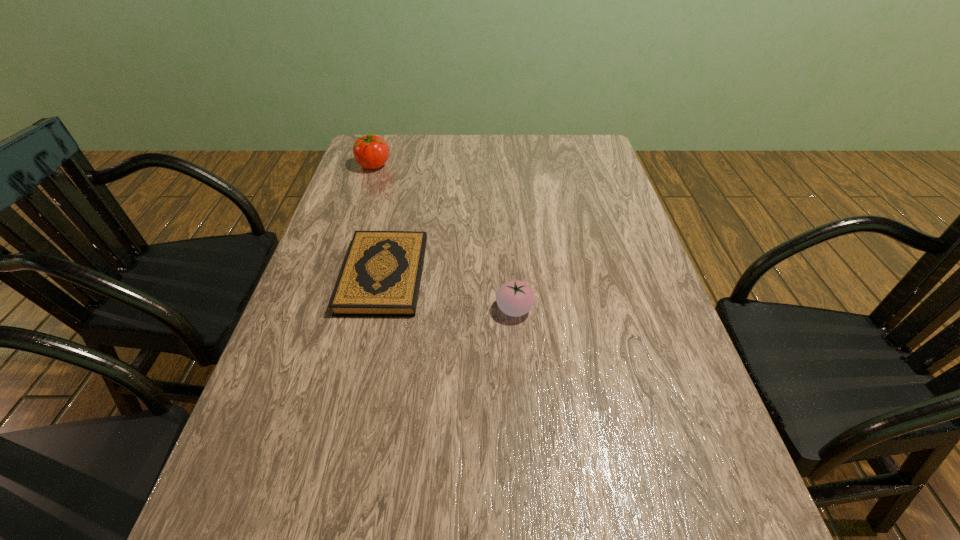
Locate an element on the screen. the left tomato is located at coordinates (371, 151).

Locate an element on the screen. the farthest object is located at coordinates (371, 151).

At what (x,y) coordinates should I click in order to perform the action: click on the second tallest object. Please return your answer as a coordinate pair (x, y). Looking at the image, I should click on (515, 298).

Identify the location of the rightmost object. (515, 298).

At what (x,y) coordinates should I click in order to perform the action: click on hardback book. Please return your answer as a coordinate pair (x, y). Looking at the image, I should click on (381, 275).

The width and height of the screenshot is (960, 540). What are the coordinates of `vacant space situated on the back of the left tomato` in the screenshot? It's located at [380, 148].

Find the location of `vacant space located 0.050m on the back of the right tomato`. vacant space located 0.050m on the back of the right tomato is located at coordinates (513, 280).

Find the location of `free space located on the front of the shortest object`. free space located on the front of the shortest object is located at coordinates (362, 375).

Locate an element on the screen. object that is at the far edge is located at coordinates (371, 151).

Where is `tomato present at the left edge`? This screenshot has height=540, width=960. tomato present at the left edge is located at coordinates (371, 151).